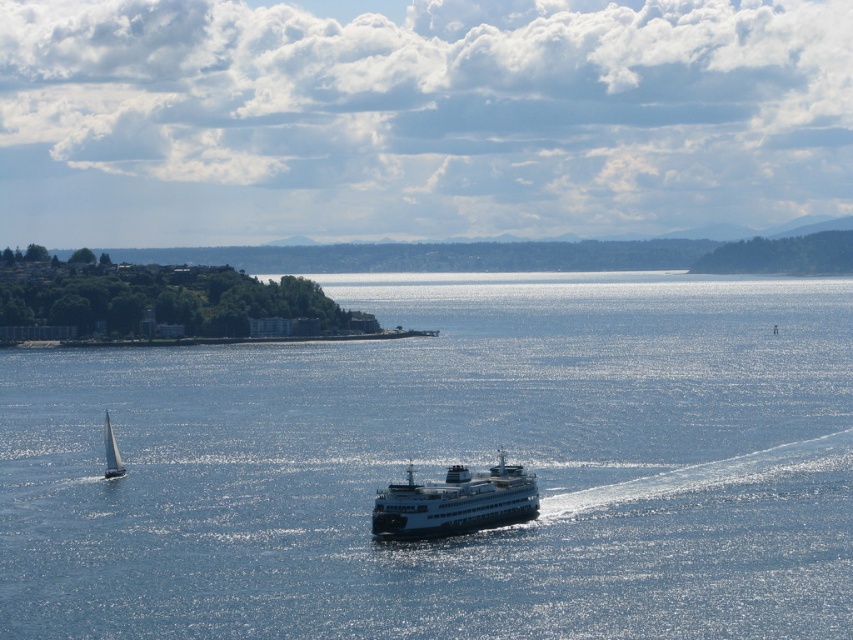
Question: Can you confirm if blue water at center is positioned below white glossy ferry at center?

Choices:
 (A) no
 (B) yes

Answer: (A)

Question: Based on their relative distances, which object is nearer to the blue water at center?

Choices:
 (A) white glossy ferry at center
 (B) white glossy sailboat at lower left

Answer: (A)

Question: Which object appears closest to the camera in this image?

Choices:
 (A) white glossy sailboat at lower left
 (B) white glossy ferry at center

Answer: (B)

Question: Does white glossy ferry at center have a lesser width compared to white glossy sailboat at lower left?

Choices:
 (A) no
 (B) yes

Answer: (A)

Question: Does blue water at center appear over white glossy ferry at center?

Choices:
 (A) yes
 (B) no

Answer: (A)

Question: Based on their relative distances, which object is nearer to the blue water at center?

Choices:
 (A) white glossy ferry at center
 (B) white glossy sailboat at lower left

Answer: (A)